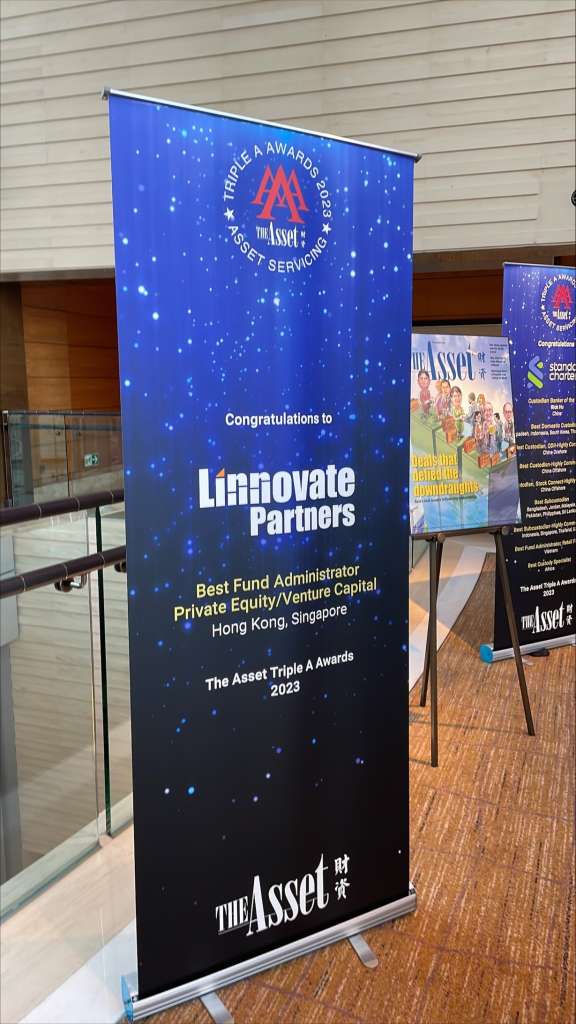
This screenshot has height=1024, width=576. In order to click on poster in this screenshot , I will do `click(477, 364)`.